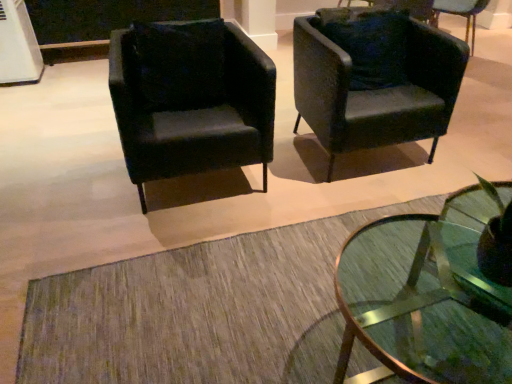
Question: Can you confirm if velvet dark green pillow at center is positioned to the right of matte black armchair at upper right, placed as the second chair when sorted from right to left?

Choices:
 (A) no
 (B) yes

Answer: (A)

Question: Is velvet dark green pillow at center facing away from matte black armchair at upper right, which ranks as the 2th chair in left-to-right order?

Choices:
 (A) yes
 (B) no

Answer: (B)

Question: Is velvet dark green pillow at center beside matte black armchair at upper right, which ranks as the 2th chair in left-to-right order?

Choices:
 (A) no
 (B) yes

Answer: (A)

Question: Is matte black armchair at upper right, which ranks as the 2th chair in left-to-right order, completely or partially inside velvet dark green pillow at center?

Choices:
 (A) no
 (B) yes

Answer: (A)

Question: Is velvet dark green pillow at center facing towards matte black armchair at upper right, which ranks as the 2th chair in left-to-right order?

Choices:
 (A) no
 (B) yes

Answer: (A)

Question: Looking at the image, does matte black armchair at upper right, which ranks as the 2th chair in left-to-right order, seem bigger or smaller compared to velvet dark green pillow at center?

Choices:
 (A) small
 (B) big

Answer: (B)

Question: Considering the positions of point (372, 142) and point (145, 84), is point (372, 142) closer or farther from the camera than point (145, 84)?

Choices:
 (A) farther
 (B) closer

Answer: (A)

Question: From their relative heights in the image, would you say matte black armchair at upper right, which ranks as the 2th chair in left-to-right order, is taller or shorter than velvet dark green pillow at center?

Choices:
 (A) short
 (B) tall

Answer: (B)

Question: From a real-world perspective, is matte black armchair at upper right, which ranks as the 2th chair in left-to-right order, above or below velvet dark green pillow at center?

Choices:
 (A) above
 (B) below

Answer: (B)

Question: From their relative heights in the image, would you say matte black armchair at left, which is the 1th chair in left-to-right order, is taller or shorter than velvet black armchair at upper right, arranged as the third chair when viewed from the left?

Choices:
 (A) tall
 (B) short

Answer: (A)

Question: Considering the positions of matte black armchair at left, which is the 1th chair in left-to-right order, and velvet black armchair at upper right, arranged as the third chair when viewed from the left, in the image, is matte black armchair at left, which is the 1th chair in left-to-right order, wider or thinner than velvet black armchair at upper right, arranged as the third chair when viewed from the left,?

Choices:
 (A) thin
 (B) wide

Answer: (B)

Question: Is matte black armchair at left, which is the 1th chair in left-to-right order, situated inside velvet black armchair at upper right, arranged as the third chair when viewed from the left, or outside?

Choices:
 (A) inside
 (B) outside

Answer: (B)

Question: Is matte black armchair at left, which is counted as the 3th chair, starting from the right, to the left or to the right of velvet black armchair at upper right, arranged as the third chair when viewed from the left, in the image?

Choices:
 (A) right
 (B) left

Answer: (B)

Question: Does point (209, 102) appear closer or farther from the camera than point (471, 4)?

Choices:
 (A) closer
 (B) farther

Answer: (A)

Question: In the image, is velvet dark green pillow at center positioned in front of or behind velvet black armchair at upper right, arranged as the third chair when viewed from the left?

Choices:
 (A) front
 (B) behind

Answer: (A)